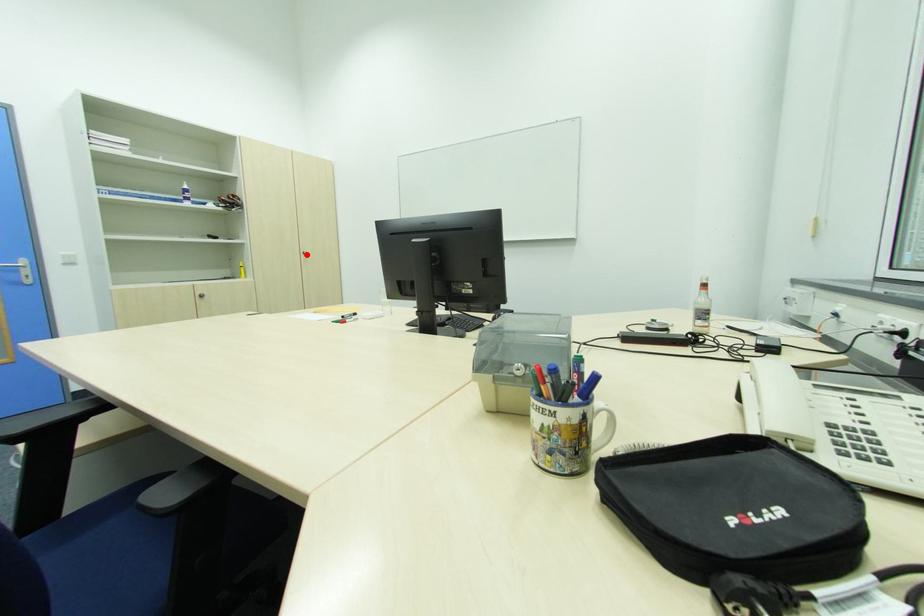
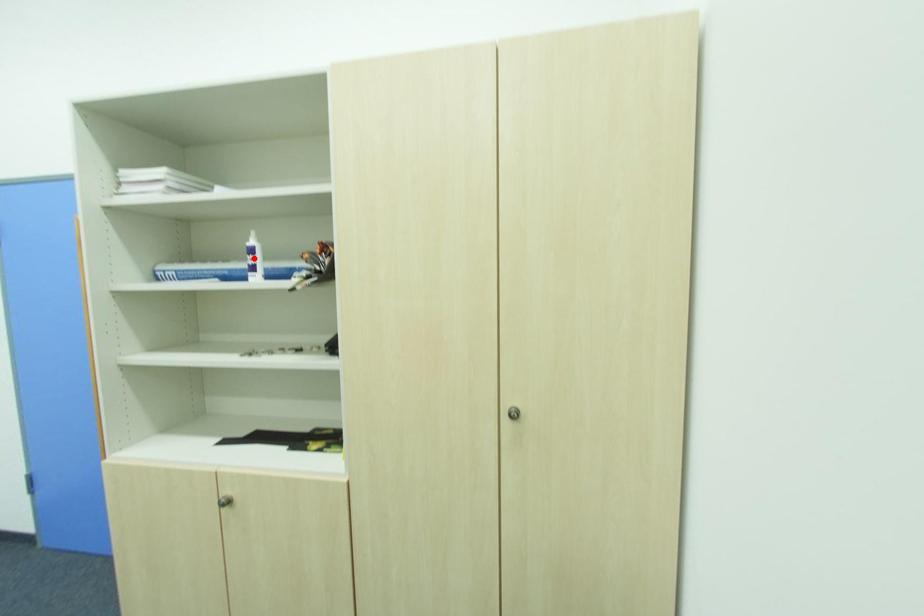
I am providing you with two images of the same scene from different viewpoints. A red point is marked on the first image and another point is marked on the second image. Do the highlighted points in image1 and image2 indicate the same real-world spot?

No